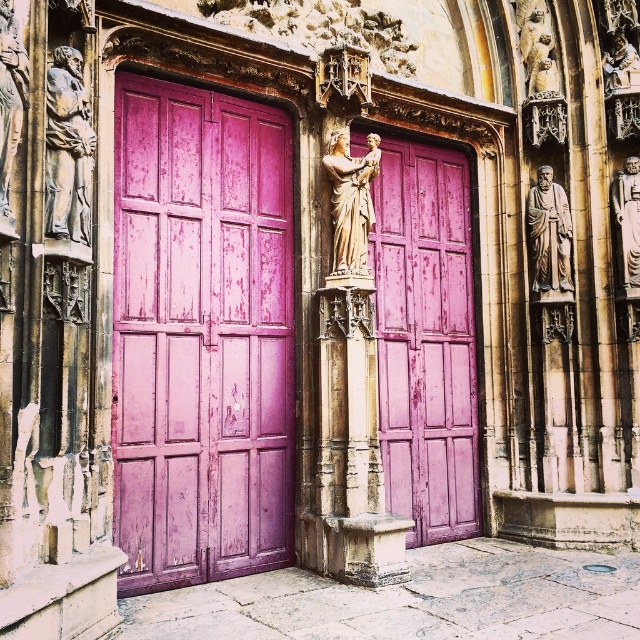
Between purple matte wood door at left and golden stone statue at upper right, which one is positioned higher?

Positioned higher is golden stone statue at upper right.

What do you see at coordinates (200, 336) in the screenshot? The width and height of the screenshot is (640, 640). I see `purple matte wood door at left` at bounding box center [200, 336].

Locate an element on the screen. This screenshot has width=640, height=640. purple matte wood door at left is located at coordinates (200, 336).

Is stone statue at right bigger than gold statue at left?

Correct, stone statue at right is larger in size than gold statue at left.

Can you confirm if stone statue at right is thinner than gold statue at left?

No, stone statue at right is not thinner than gold statue at left.

Locate an element on the screen. Image resolution: width=640 pixels, height=640 pixels. stone statue at right is located at coordinates (548, 236).

Locate an element on the screen. stone statue at right is located at coordinates (x=548, y=236).

Does gold statue at left have a larger size compared to polished stone statue at right?

No, gold statue at left is not bigger than polished stone statue at right.

Measure the distance from gold statue at left to polished stone statue at right.

6.31 meters

Image resolution: width=640 pixels, height=640 pixels. What do you see at coordinates (10, 97) in the screenshot?
I see `gold statue at left` at bounding box center [10, 97].

Where is `gold statue at left`? gold statue at left is located at coordinates (10, 97).